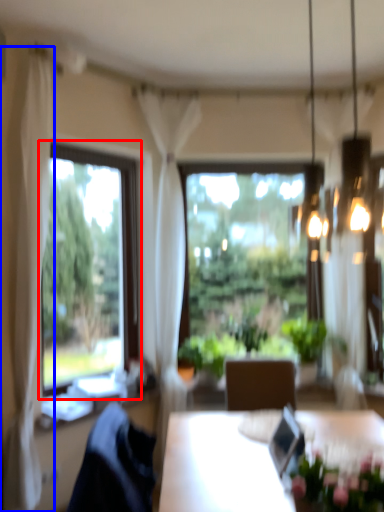
Question: Which of the following is the closest to the observer, window (highlighted by a red box) or curtain (highlighted by a blue box)?

Choices:
 (A) window
 (B) curtain

Answer: (B)